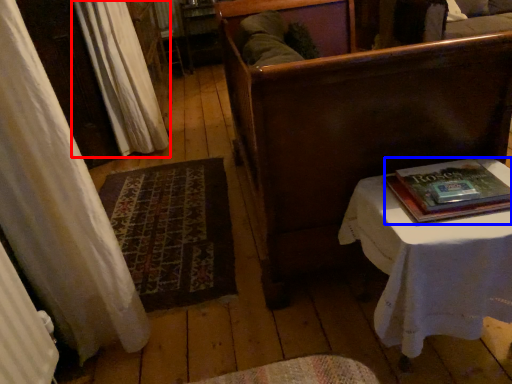
Question: Which point is closer to the camera, curtain (highlighted by a red box) or paperback book (highlighted by a blue box)?

Choices:
 (A) curtain
 (B) paperback book

Answer: (B)